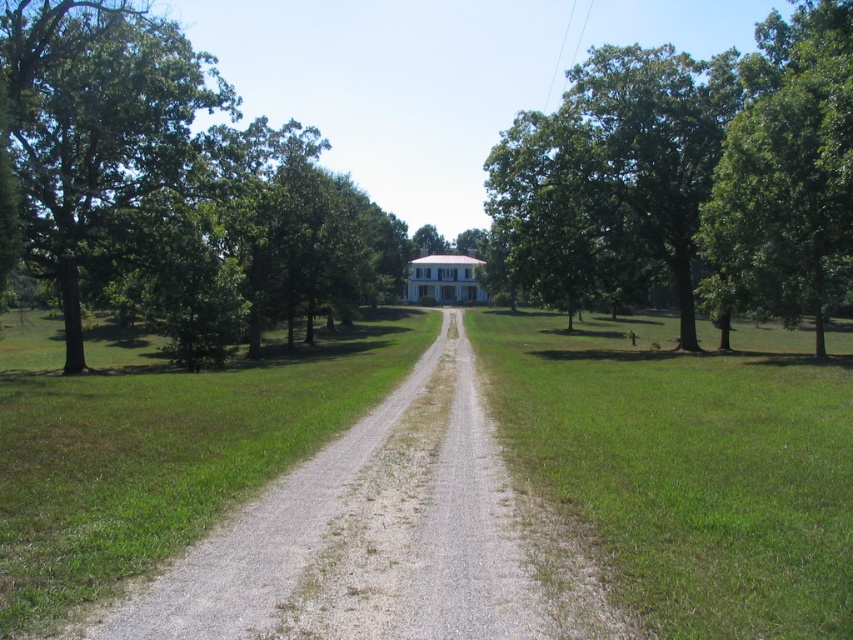
You are a hiker walking along the gray gravel road at center and want to find shade. Is the green leafy tree at right located above the road where you are walking?

The gray gravel road at center is positioned under the green leafy tree at right, so yes, the tree is above the road, providing shade.

You are standing at the entrance of the white two story house with a red roof and want to walk towards the green leafy tree at upper left and the green leafy tree at right. Which tree would you have to walk further to reach?

The green leafy tree at upper left might be wider than green leafy tree at right, but the question is about distance to reach them. Since the description only mentions their width, not their distance from the house, you cannot determine which requires walking further based on the provided information.

You are standing at the entrance of the white two story house with a red roof and want to walk to the green leafy tree at upper left. The gravel path is 1.5 meters wide. Can you walk directly to the tree along the path?

The green leafy tree at upper left is 24.18 meters from viewer. Since the gravel path is 1.5 meters wide, you can walk directly to the tree along the path as the width is sufficient for a person to walk.